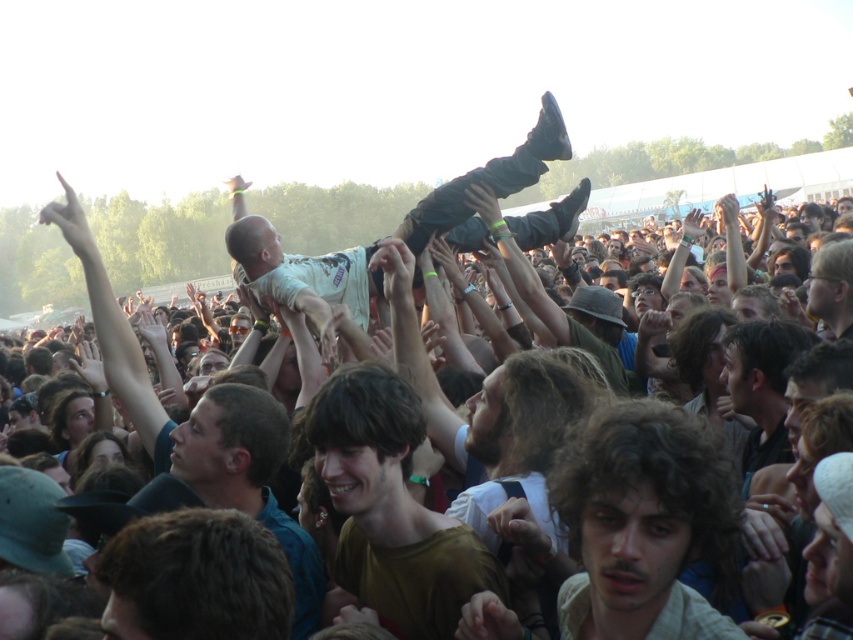
Which is more to the left, brown matte shirt at center or light brown fabric baby at center?

brown matte shirt at center is more to the left.

Does brown matte shirt at center appear on the left side of light brown fabric baby at center?

Correct, you'll find brown matte shirt at center to the left of light brown fabric baby at center.

Which is in front, point (401, 467) or point (500, 157)?

Positioned in front is point (401, 467).

Where is `brown matte shirt at center`? This screenshot has height=640, width=853. brown matte shirt at center is located at coordinates (392, 508).

Is curly hair at center above light brown fabric baby at center?

Incorrect, curly hair at center is not positioned above light brown fabric baby at center.

In order to click on curly hair at center in this screenshot , I will do `click(643, 522)`.

The image size is (853, 640). I want to click on brown hair at lower left, so click(196, 579).

Can you confirm if brown hair at lower left is positioned to the left of light brown fabric baby at center?

Yes, brown hair at lower left is to the left of light brown fabric baby at center.

Describe the element at coordinates (196, 579) in the screenshot. The width and height of the screenshot is (853, 640). I see `brown hair at lower left` at that location.

This screenshot has height=640, width=853. What are the coordinates of `brown hair at lower left` in the screenshot? It's located at (196, 579).